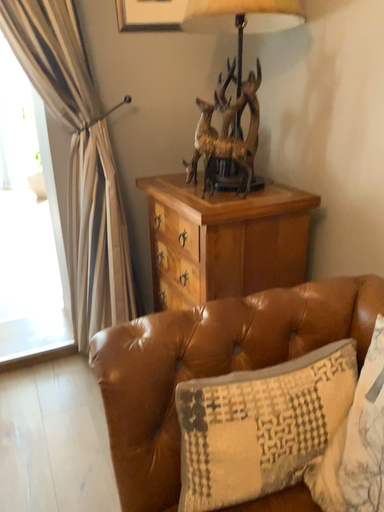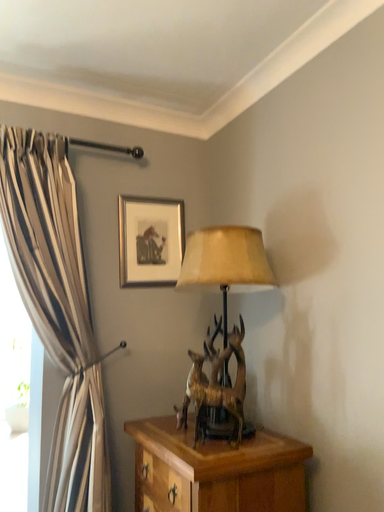
Question: How did the camera likely rotate when shooting the video?

Choices:
 (A) rotated upward
 (B) rotated downward

Answer: (A)